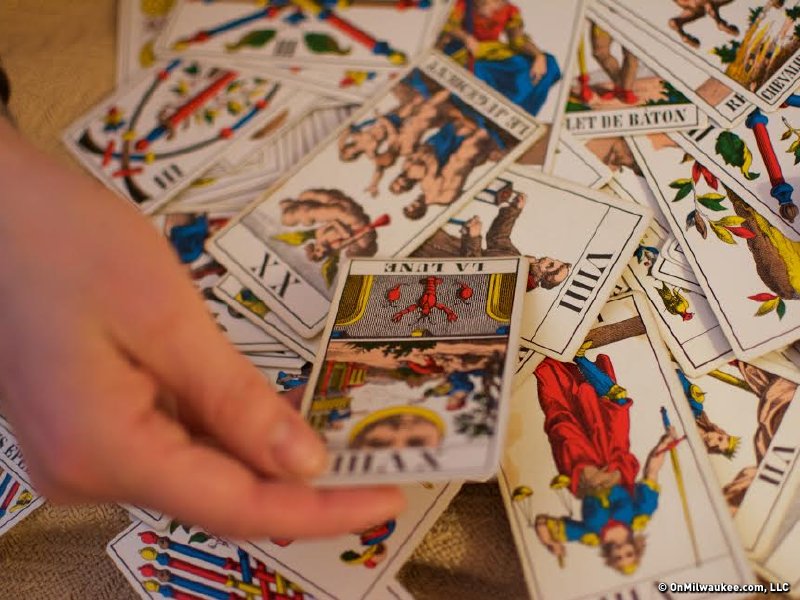
Locate an element on the screen. Image resolution: width=800 pixels, height=600 pixels. plant is located at coordinates (714, 215).